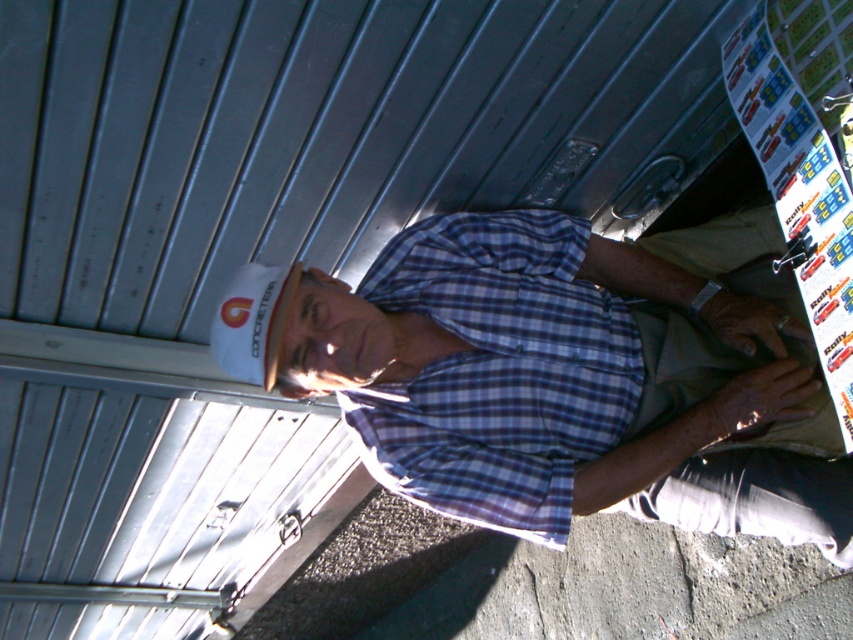
Question: Can you confirm if white hard hat at upper left is positioned above khaki fabric at lower right?

Choices:
 (A) yes
 (B) no

Answer: (A)

Question: Which object is closer to the camera taking this photo?

Choices:
 (A) blue checkered shirt at center
 (B) white hard hat at upper left
 (C) khaki fabric at lower right

Answer: (B)

Question: Which point is farther from the camera taking this photo?

Choices:
 (A) (846, 561)
 (B) (328, 339)

Answer: (A)

Question: Does white hard hat at upper left appear over khaki fabric at lower right?

Choices:
 (A) no
 (B) yes

Answer: (B)

Question: Can you confirm if white hard hat at upper left is positioned to the right of khaki fabric at lower right?

Choices:
 (A) yes
 (B) no

Answer: (B)

Question: Which object is the farthest from the blue checkered shirt at center?

Choices:
 (A) khaki fabric at lower right
 (B) white hard hat at upper left

Answer: (A)